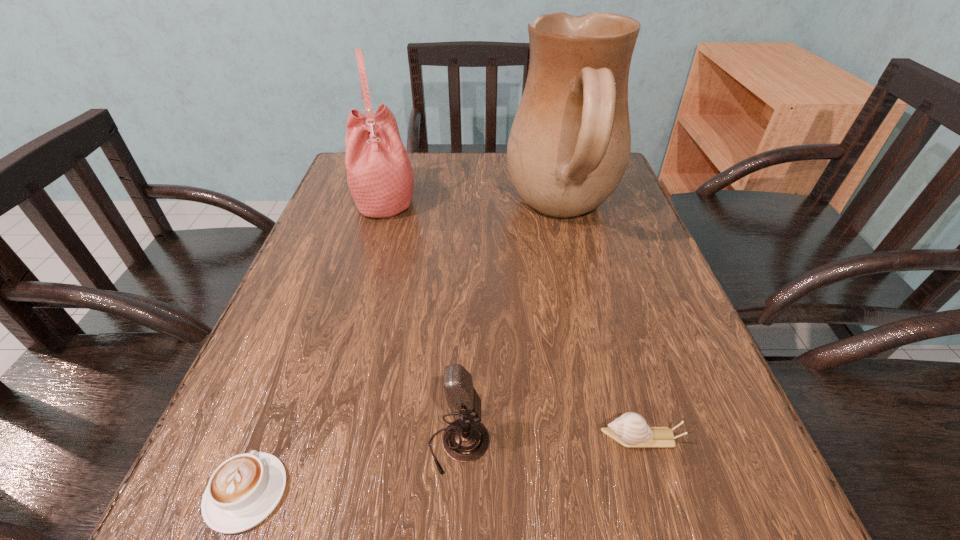
Where is `free space located 0.060m on the front-facing side of the microphone`? Image resolution: width=960 pixels, height=540 pixels. free space located 0.060m on the front-facing side of the microphone is located at coordinates (533, 446).

You are a GUI agent. You are given a task and a screenshot of the screen. Output one action in this format:
    pyautogui.click(x=<x>, y=<y>)
    Task: Click on the free spot located on the shell of the escargot
    This screenshot has height=540, width=960.
    Given the screenshot: What is the action you would take?
    pyautogui.click(x=460, y=438)

Where is `blank area located on the shell of the escargot`? This screenshot has height=540, width=960. blank area located on the shell of the escargot is located at coordinates click(x=566, y=438).

I want to click on free space located on the shell of the escargot, so click(474, 438).

Find the location of a particular element. Image resolution: width=960 pixels, height=540 pixels. vacant position located with the handle on the right side of the cappuccino is located at coordinates (327, 281).

Image resolution: width=960 pixels, height=540 pixels. I want to click on free space located with the handle on the right side of the cappuccino, so click(x=291, y=375).

Locate an element on the screen. vacant space positioned with the handle on the right side of the cappuccino is located at coordinates (278, 409).

At what (x,y) coordinates should I click in order to perform the action: click on cream pitcher at the far edge. Please return your answer as a coordinate pair (x, y). The height and width of the screenshot is (540, 960). Looking at the image, I should click on coord(569,146).

I want to click on handbag that is at the far edge, so click(x=380, y=177).

Locate an element on the screen. The height and width of the screenshot is (540, 960). object that is at the near edge is located at coordinates (244, 490).